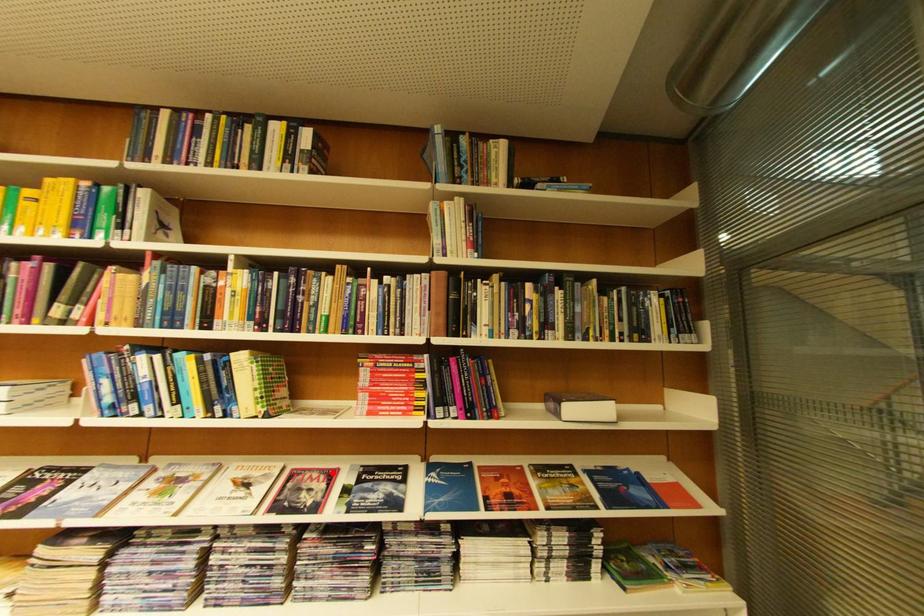
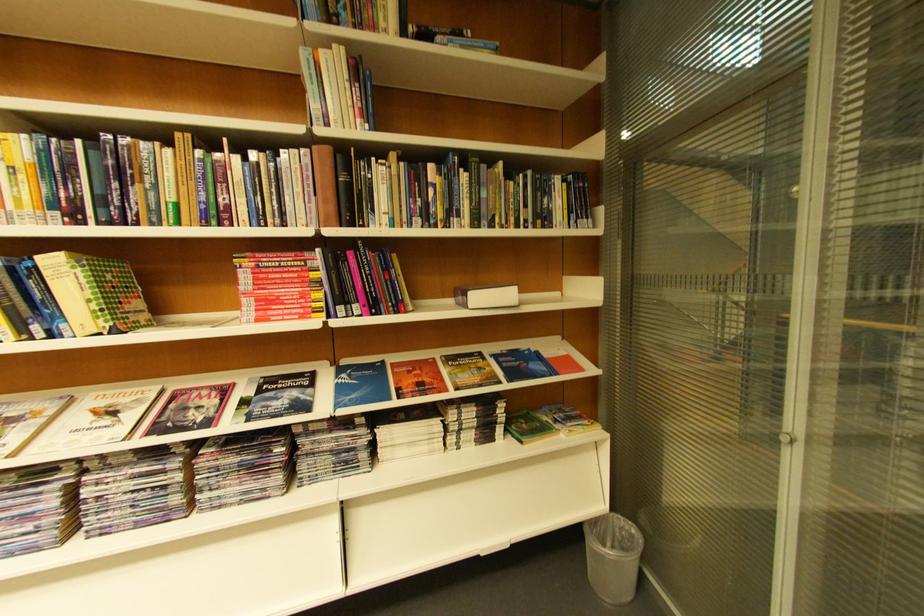
Locate, in the second image, the point that corresponds to the highlighted location in the first image.

(224, 389)